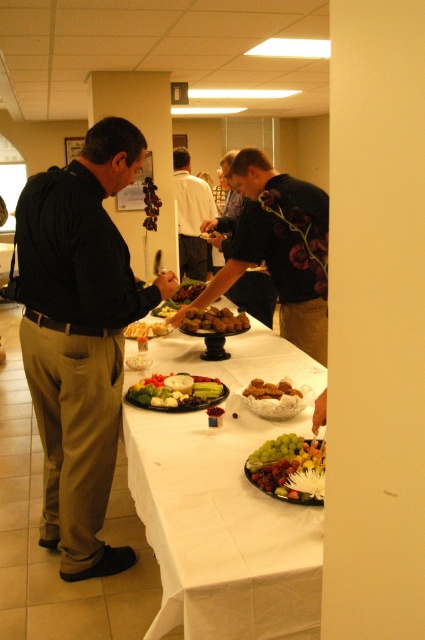
Question: Among these points, which one is farthest from the camera?

Choices:
 (A) (189, 282)
 (B) (133, 556)

Answer: (A)

Question: In this image, where is green leafy vegetables at center located relative to brown matte meatballs at center?

Choices:
 (A) right
 (B) left

Answer: (B)

Question: Which of the following is the farthest from the observer?

Choices:
 (A) (158, 394)
 (B) (189, 298)
 (C) (70, 442)

Answer: (B)

Question: Does white shirt at center appear on the right side of white glossy cheese at center?

Choices:
 (A) no
 (B) yes

Answer: (B)

Question: Among these objects, which one is farthest from the camera?

Choices:
 (A) green leafy vegetables at center
 (B) glossy white platter at center
 (C) white glossy cheese at center
 (D) white shirt at center

Answer: (D)

Question: Can you confirm if black matte sweater at center is bigger than golden brown bread at center?

Choices:
 (A) yes
 (B) no

Answer: (A)